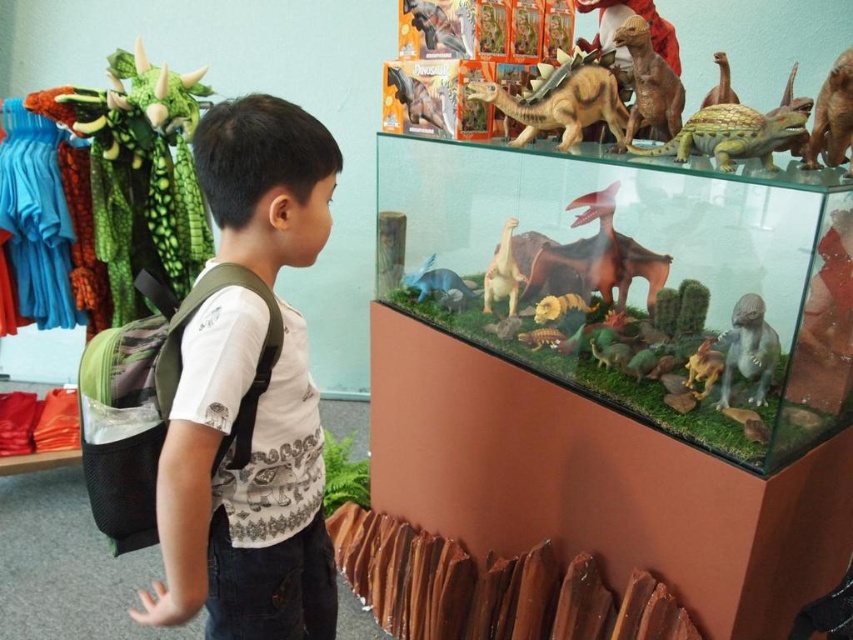
Question: Which point is farther to the camera?

Choices:
 (A) (297, 316)
 (B) (485, 300)

Answer: (B)

Question: Is white cotton shirt at center further to the viewer compared to brown matte dinosaur at center?

Choices:
 (A) yes
 (B) no

Answer: (B)

Question: Which object appears closest to the camera in this image?

Choices:
 (A) matte brown dinosaur at center
 (B) green matte dinosaur at lower right
 (C) white cotton shirt at center
 (D) smooth brown dinosaur at upper right

Answer: (C)

Question: Is brown matte dinosaur at center positioned before matte brown dinosaur at center?

Choices:
 (A) no
 (B) yes

Answer: (B)

Question: Which point is closer to the camera taking this photo?

Choices:
 (A) (730, 371)
 (B) (637, 17)

Answer: (A)

Question: Does brown plastic dinosaur at upper center come in front of white cotton shirt at center?

Choices:
 (A) no
 (B) yes

Answer: (A)